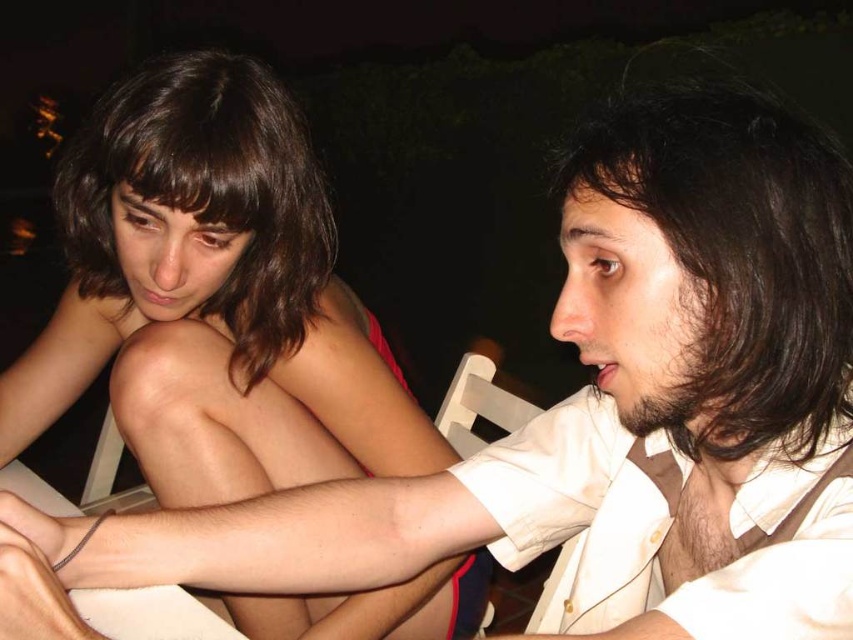
You are a photographer trying to capture a closeup of the dark brown wavy hair at right and the dark brown wavy hair at upper left. Which hair should you focus on first to ensure both are in sharp focus?

The dark brown wavy hair at right is closer to the viewer than dark brown wavy hair at upper left. To ensure both are in sharp focus, you should focus on the dark brown wavy hair at right first, as it is closer, and the depth of field may naturally include the farther hair if focused on the closer one.